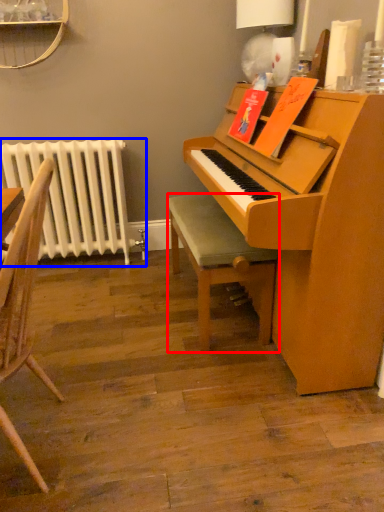
Question: Which object appears closest to the camera in this image, stool (highlighted by a red box) or radiator (highlighted by a blue box)?

Choices:
 (A) stool
 (B) radiator

Answer: (A)